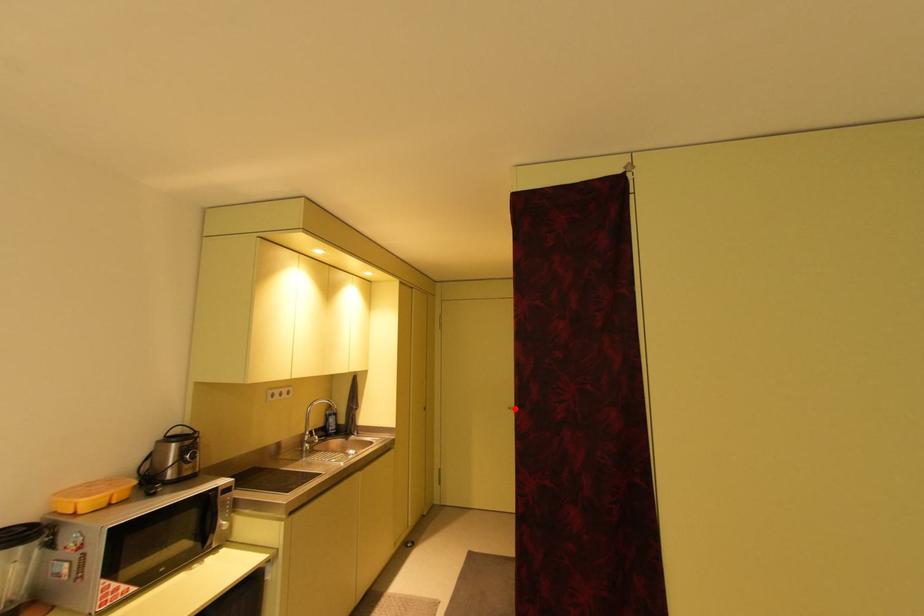
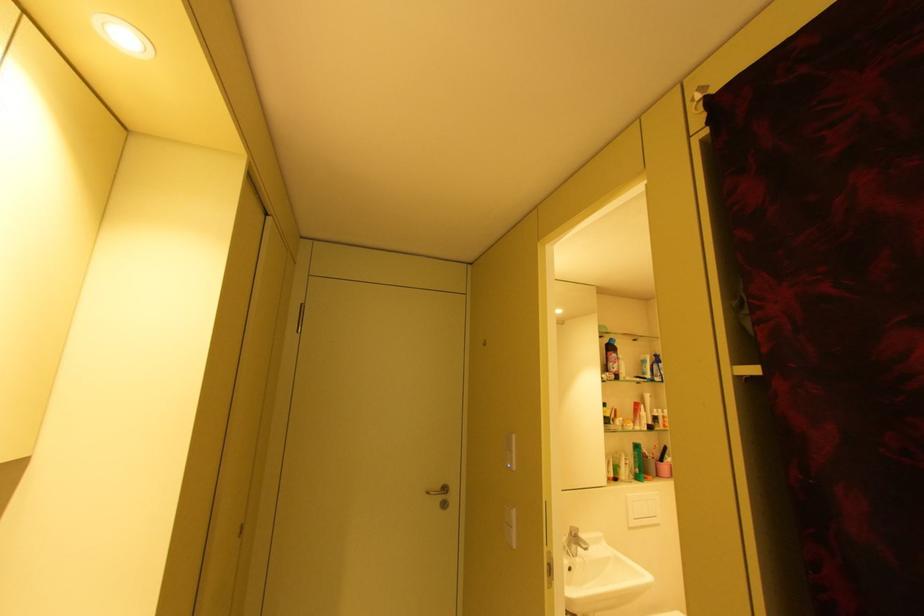
Find the pixel in the second image that matches the highlighted location in the first image.

(434, 493)